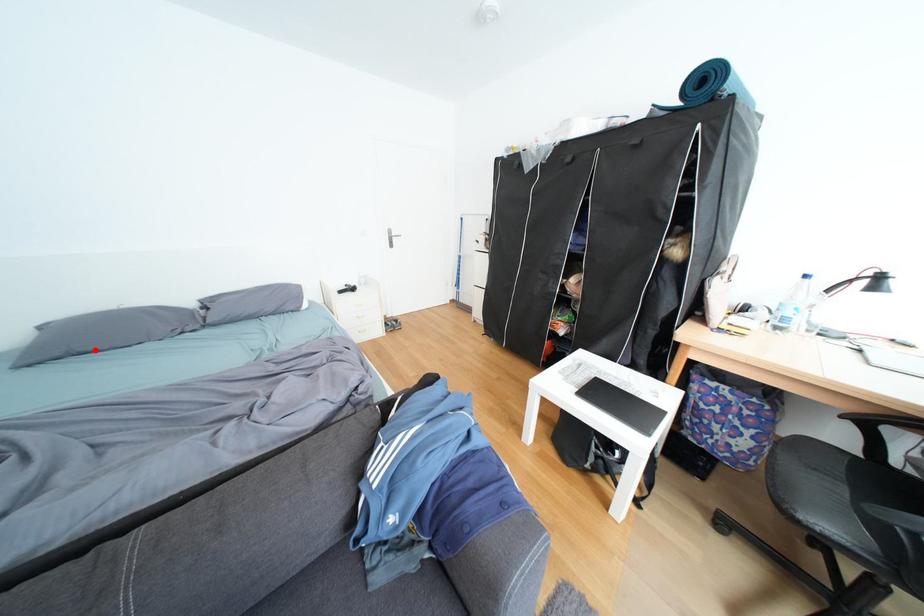
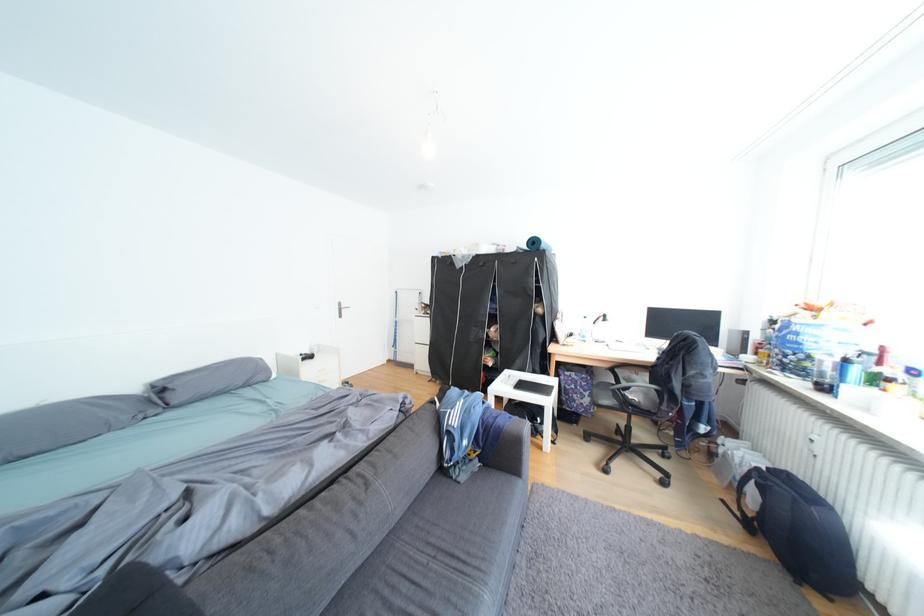
The point at the highlighted location is marked in the first image. Where is the corresponding point in the second image?

(40, 453)